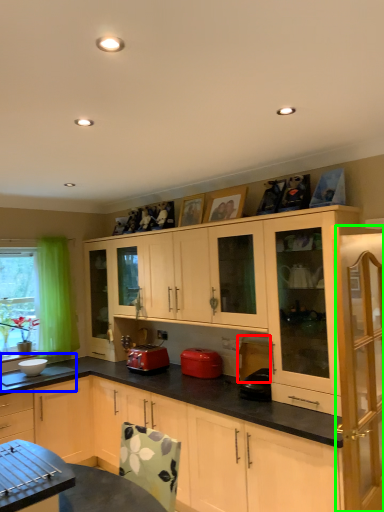
Question: Which object is positioned closest to appliance (highlighted by a red box)? Select from sink (highlighted by a blue box) and cabinetry (highlighted by a green box).

Choices:
 (A) sink
 (B) cabinetry

Answer: (B)